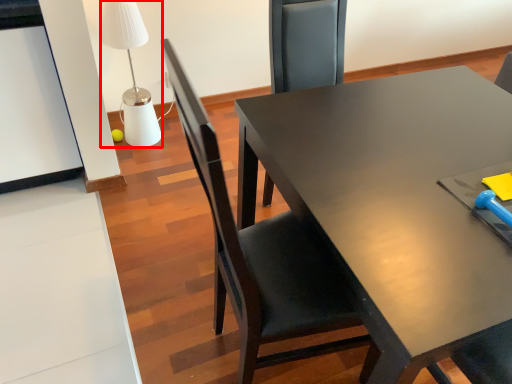
Question: Observing the image, what is the correct spatial positioning of table lamp (annotated by the red box) in reference to chair?

Choices:
 (A) right
 (B) left

Answer: (B)